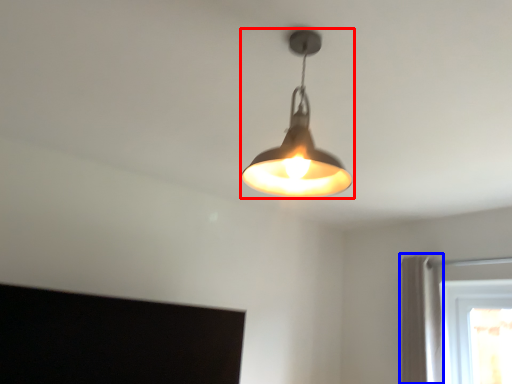
Question: Which of the following is the closest to the observer, lamp (highlighted by a red box) or curtain (highlighted by a blue box)?

Choices:
 (A) lamp
 (B) curtain

Answer: (A)